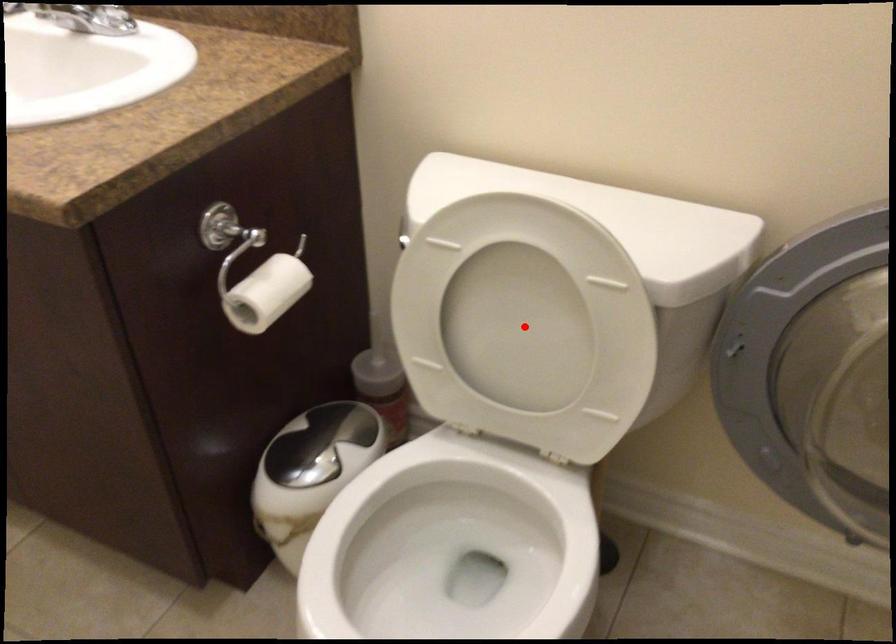
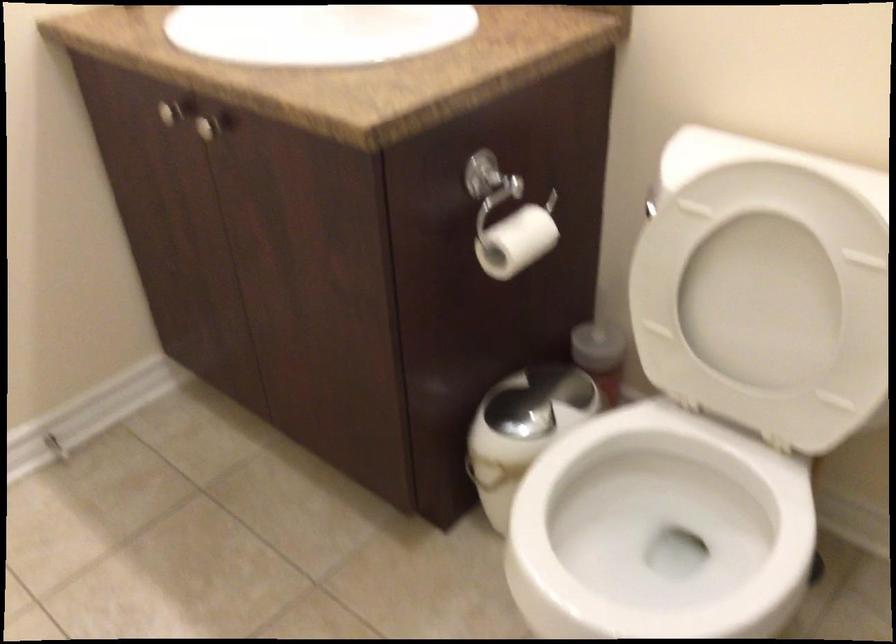
Find the pixel in the second image that matches the highlighted location in the first image.

(763, 299)